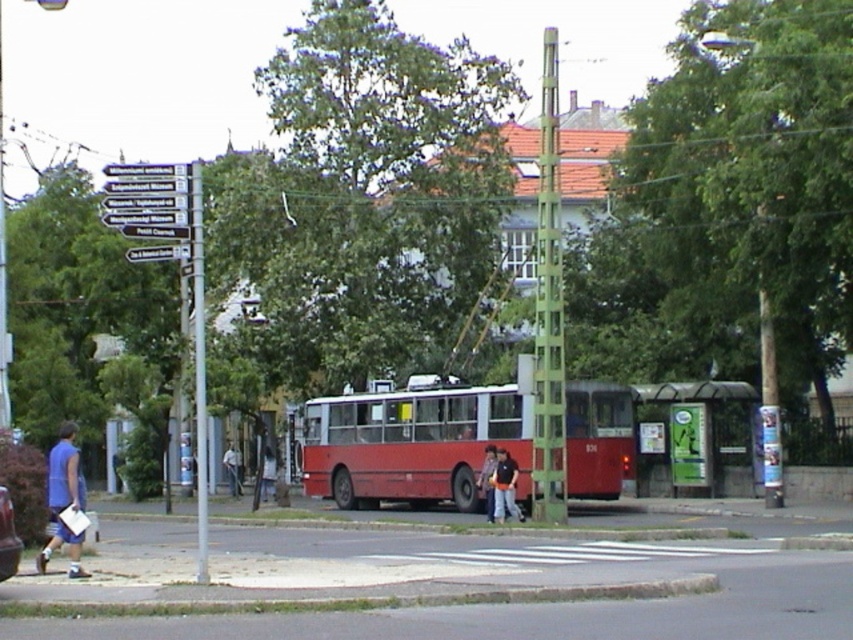
Measure the distance between point (334, 396) and camera.

Point (334, 396) and camera are 123.51 feet apart from each other.

Is red matte bus at center to the right of matte black jacket at center from the viewer's perspective?

Indeed, red matte bus at center is positioned on the right side of matte black jacket at center.

Which is in front, point (520, 497) or point (274, 492)?

Positioned in front is point (520, 497).

You are a GUI agent. You are given a task and a screenshot of the screen. Output one action in this format:
    pyautogui.click(x=<x>, y=<y>)
    Task: Click on the red matte bus at center
    This screenshot has width=853, height=640.
    Given the screenshot: What is the action you would take?
    pyautogui.click(x=412, y=444)

Does blue fabric shirt at lower left appear on the left side of light blue jeans at lower center?

Correct, you'll find blue fabric shirt at lower left to the left of light blue jeans at lower center.

Is blue fabric shirt at lower left below light blue jeans at lower center?

Actually, blue fabric shirt at lower left is above light blue jeans at lower center.

The height and width of the screenshot is (640, 853). What are the coordinates of `blue fabric shirt at lower left` in the screenshot? It's located at (64, 499).

The image size is (853, 640). I want to click on blue fabric shirt at lower left, so click(x=64, y=499).

Which is more to the right, green leafy tree at center or blue fabric shirt at lower left?

Positioned to the right is green leafy tree at center.

Can you confirm if green leafy tree at center is thinner than blue fabric shirt at lower left?

Incorrect, green leafy tree at center's width is not less than blue fabric shirt at lower left's.

What do you see at coordinates (752, 196) in the screenshot?
I see `green leafy tree at center` at bounding box center [752, 196].

Identify the location of green leafy tree at center. (752, 196).